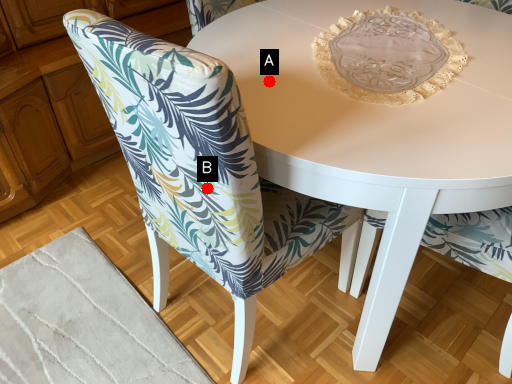
Question: Two points are circled on the image, labeled by A and B beside each circle. Which of the following is the farthest from the observer?

Choices:
 (A) A is further
 (B) B is further

Answer: (A)